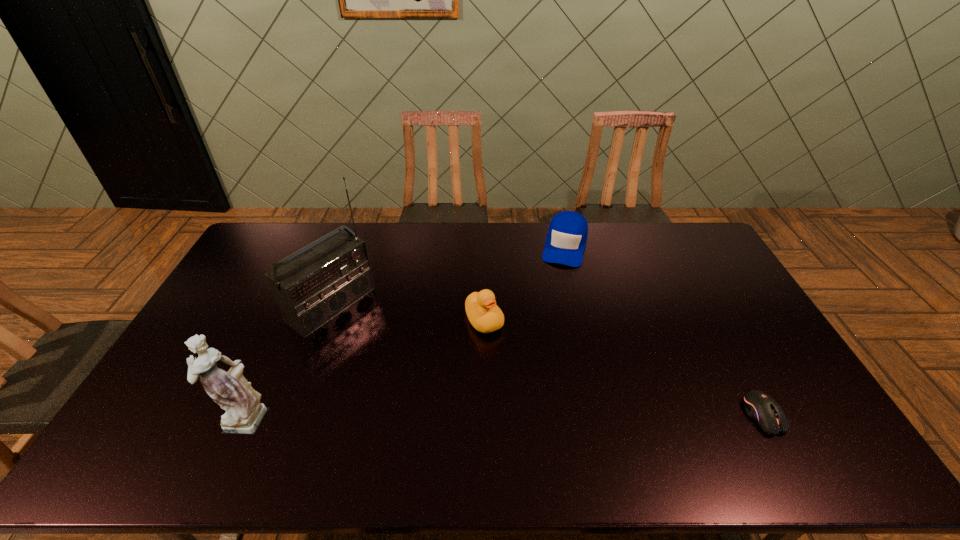
This screenshot has height=540, width=960. Find the location of `free point located on the front-facing side of the second shortest object`. free point located on the front-facing side of the second shortest object is located at coordinates (554, 300).

Where is `object that is positioned at the far edge`? object that is positioned at the far edge is located at coordinates (567, 235).

The image size is (960, 540). Find the location of `figurine situated at the near edge`. figurine situated at the near edge is located at coordinates (244, 412).

Find the location of a particular element. computer mouse situated at the near edge is located at coordinates (763, 409).

Locate an element on the screen. Image resolution: width=960 pixels, height=540 pixels. object present at the right edge is located at coordinates (763, 409).

Find the location of a particular element. Image resolution: width=960 pixels, height=540 pixels. object that is at the near right corner is located at coordinates (763, 409).

You are a GUI agent. You are given a task and a screenshot of the screen. Output one action in this format:
    pyautogui.click(x=<x>, y=<y>)
    Task: Click on the vacant space at the far edge of the desktop
    This screenshot has width=960, height=540.
    Given the screenshot: What is the action you would take?
    pyautogui.click(x=491, y=225)

Find the location of a particular element. free space at the near edge of the desktop is located at coordinates (347, 407).

Find the location of `free spot at the left edge of the desktop`. free spot at the left edge of the desktop is located at coordinates (261, 291).

The image size is (960, 540). Identify the location of vacant space at the right edge of the desktop. (682, 268).